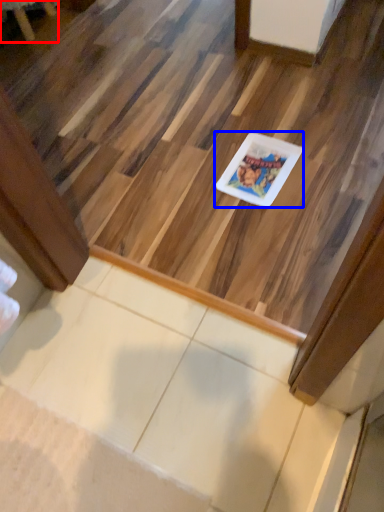
Question: Which point is closer to the camera, furniture (highlighted by a red box) or glass plate (highlighted by a blue box)?

Choices:
 (A) furniture
 (B) glass plate

Answer: (B)